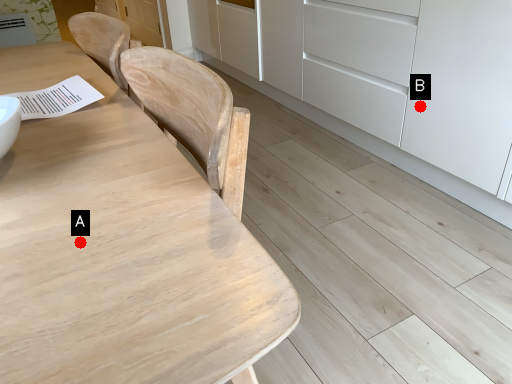
Question: Two points are circled on the image, labeled by A and B beside each circle. Which point is farther from the camera taking this photo?

Choices:
 (A) A is further
 (B) B is further

Answer: (B)